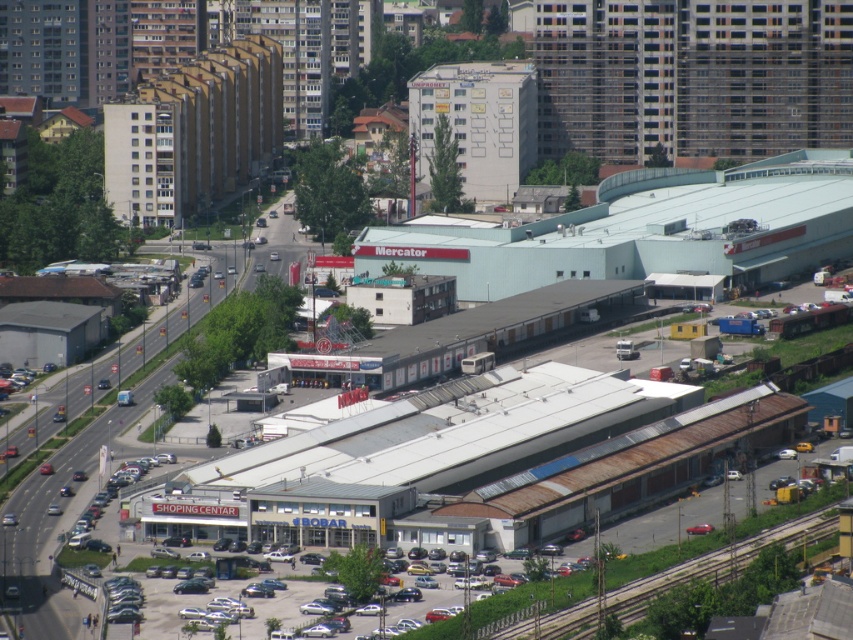
Can you confirm if white corrugated metal shopping center at center is shorter than rusty metal train track at lower right?

No.

Who is more forward, (624, 90) or (695, 556)?

Point (695, 556) is more forward.

Does point (700, 150) lie in front of point (770, 544)?

That is False.

Where is `white corrugated metal shopping center at center`? Image resolution: width=853 pixels, height=640 pixels. white corrugated metal shopping center at center is located at coordinates (691, 76).